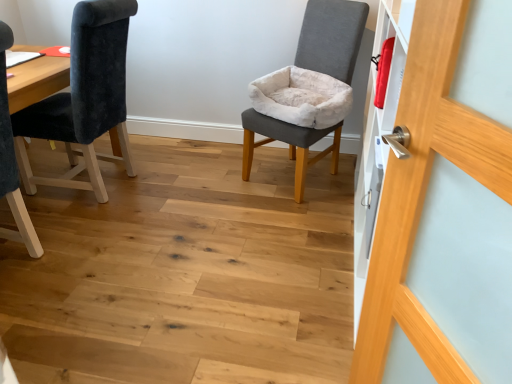
In order to click on free space in front of gray fabric chair at center, the 1th chair viewed from the right in this screenshot , I will do `click(293, 220)`.